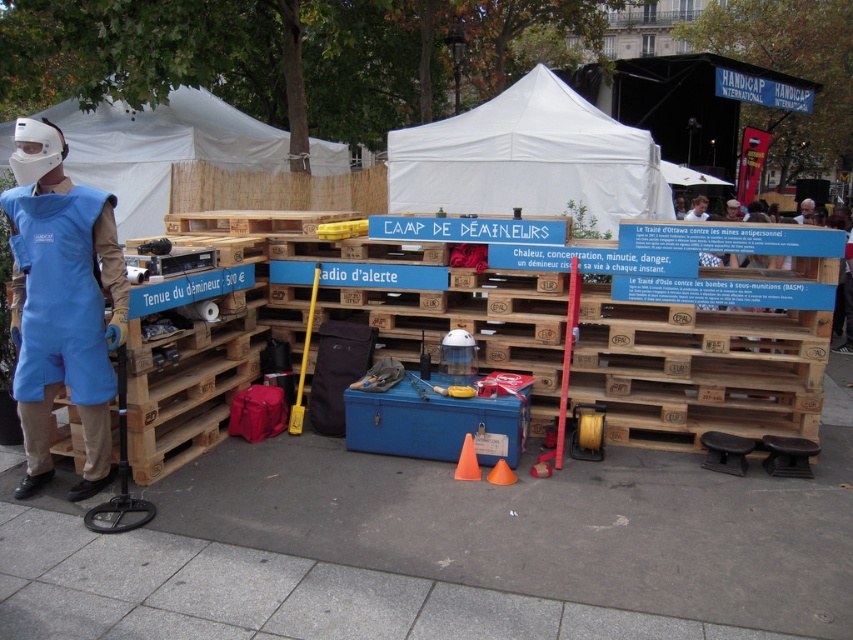
What is the relationship in height between the gray concrete pavement at lower center and the white fabric tent at center in the image?

The gray concrete pavement at lower center is shorter than the white fabric tent at center.

What is the spatial relationship between the gray concrete pavement at lower center and the white fabric tent at center?

The gray concrete pavement at lower center is in front of the white fabric tent at center.